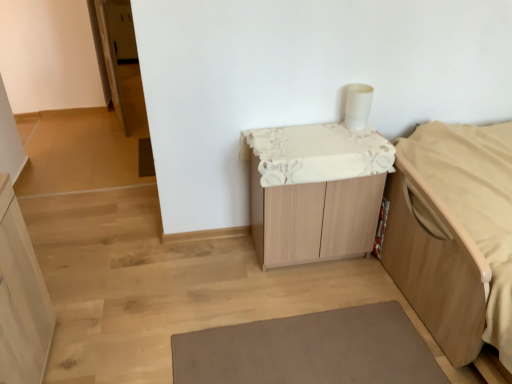
Locate an element on the screen. free space above wooden cabinet at center (from a real-world perspective) is located at coordinates (316, 141).